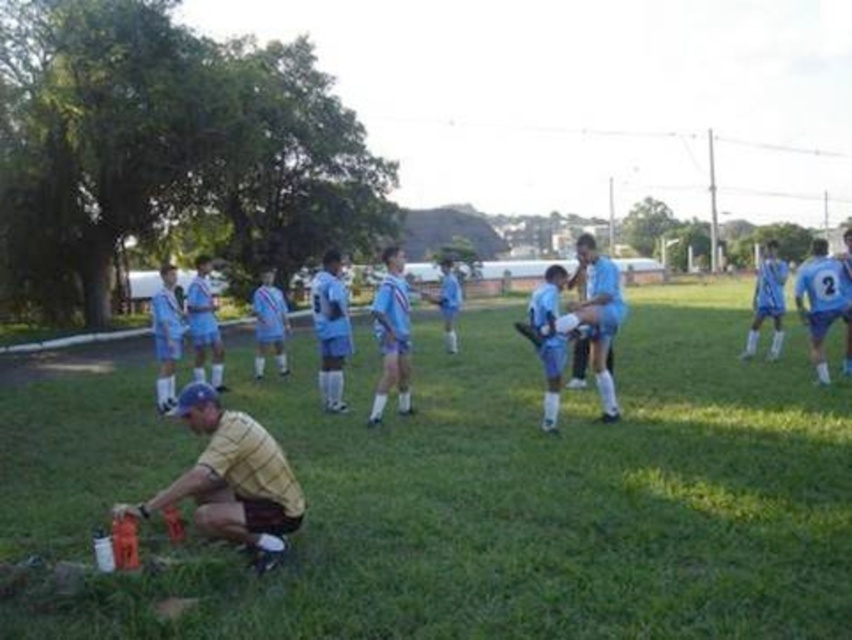
Question: Can you confirm if green grass at lower center is wider than light blue fabric shorts at center?

Choices:
 (A) no
 (B) yes

Answer: (B)

Question: Which point is closer to the camera?

Choices:
 (A) (836, 259)
 (B) (254, 438)
 (C) (521, 602)
 (D) (602, 273)

Answer: (C)

Question: Based on their relative distances, which object is farther from the light blue fabric shorts at center?

Choices:
 (A) yellow plaid shirt at lower left
 (B) green grass at lower center
 (C) light blue fabric uniform at center

Answer: (A)

Question: Does light blue fabric uniform at center have a greater width compared to yellow plaid shirt at lower left?

Choices:
 (A) yes
 (B) no

Answer: (A)

Question: Is light blue fabric uniform at center thinner than yellow plaid shirt at lower left?

Choices:
 (A) no
 (B) yes

Answer: (A)

Question: Which object is farther from the camera taking this photo?

Choices:
 (A) yellow plaid shirt at lower left
 (B) light blue fabric shorts at center

Answer: (B)